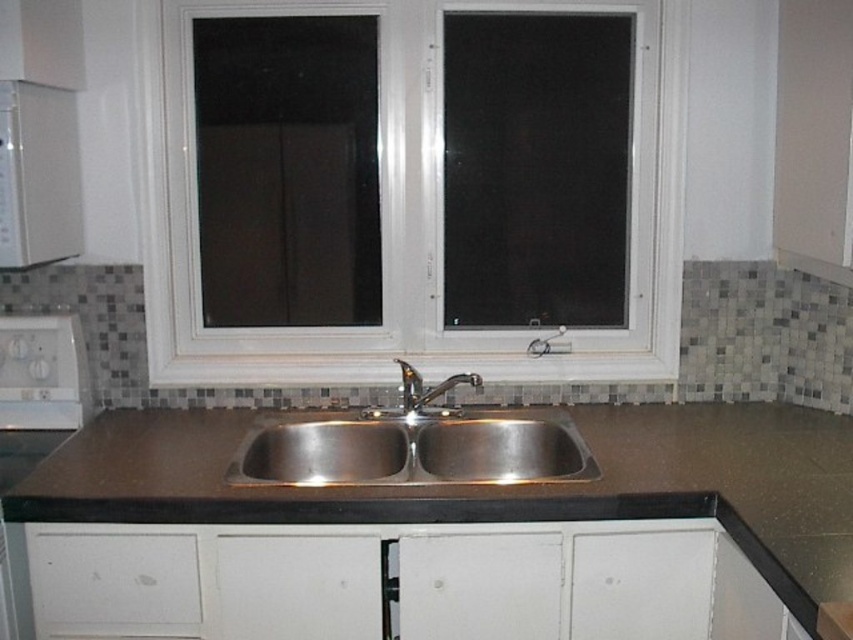
Can you confirm if brown laminate countertop at center is bigger than stainless steel sink at center?

Correct, brown laminate countertop at center is larger in size than stainless steel sink at center.

At what (x,y) coordinates should I click in order to perform the action: click on brown laminate countertop at center. Please return your answer as a coordinate pair (x, y). This screenshot has height=640, width=853. Looking at the image, I should click on (445, 536).

Measure the distance between white plastic window at center and camera.

white plastic window at center and camera are 6.96 feet apart from each other.

Between white plastic window at center and polished stainless steel faucet at center, which one appears on the left side from the viewer's perspective?

Positioned to the left is white plastic window at center.

Which is behind, point (648, 108) or point (395, 358)?

Positioned behind is point (395, 358).

The width and height of the screenshot is (853, 640). Find the location of `white plastic window at center`. white plastic window at center is located at coordinates (405, 212).

Can you confirm if white plastic window at center is taller than stainless steel sink at center?

Yes.

Between white plastic window at center and stainless steel sink at center, which one has more height?

white plastic window at center is taller.

Does point (555, 364) lie in front of point (514, 435)?

No.

I want to click on white plastic window at center, so click(405, 212).